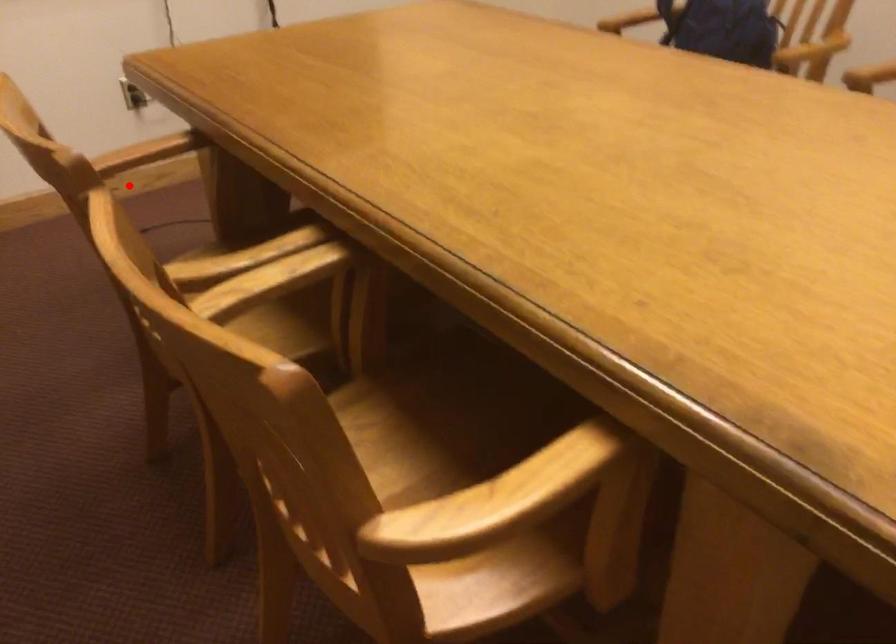
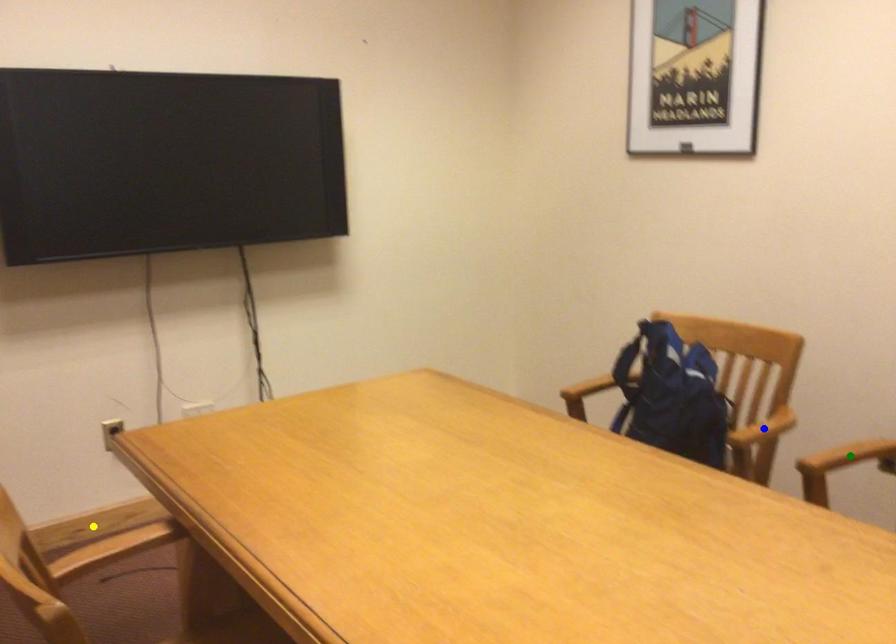
Question: I am providing you with two images of the same scene from different viewpoints. A red point is marked on the first image. You are given multiple points on the second image. Can you choose the point in image 2 that corresponds to the point in image 1?

Choices:
 (A) blue point
 (B) green point
 (C) yellow point

Answer: (C)